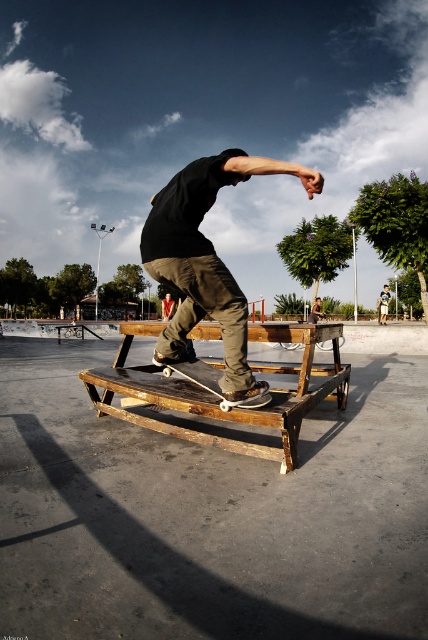
Looking at this image, you are a photographer at the skatepark. You want to capture the skateboarder and the skateboard in your shot. The skateboard is at point (205, 260). Where should you focus your camera to ensure both the skateboarder and the skateboard are in the frame?

The point (205, 260) indicates the matte black skateboard at center, so focusing on that point will capture both the skateboarder and the skateboard in the frame.

In the scene shown: You are a skateboarder who just finished a trick and your white plastic skateboard at center is now 23.98 inches away from the wooden bench at center. If you need to grab your skateboard before it rolls into the bench, can you reach it in time if your maximum reach is 24 inches?

The distance between the wooden bench at center and the white plastic skateboard at center is 23.98 inches, which is just under your maximum reach of 24 inches. Therefore, you can reach the white plastic skateboard at center before it hits the wooden bench at center.